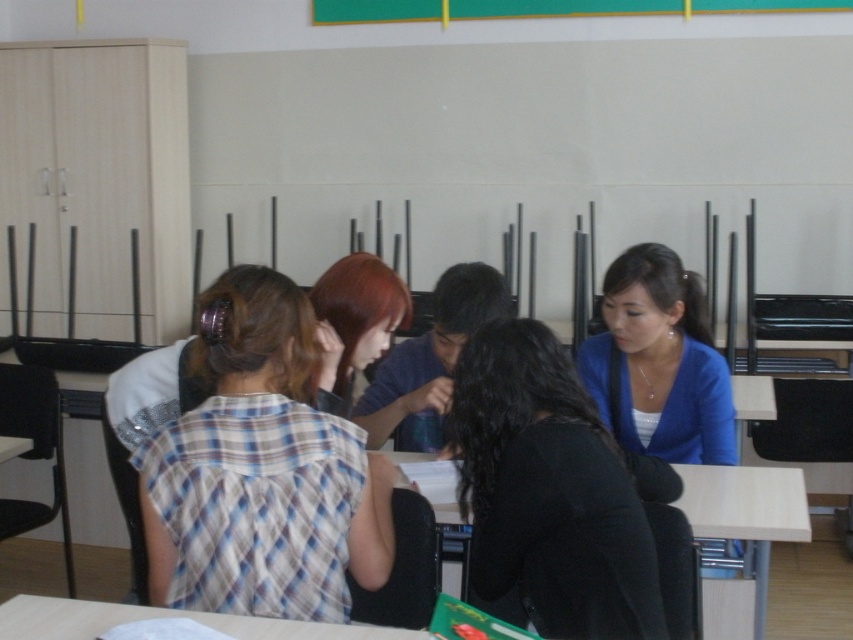
You are a photographer setting up for a group photo in the classroom. You need to ensure that the shiny brown hair at center and the green matte board at upper center are both visible in the frame. Based on their positions, which object should you prioritize keeping centered to avoid one blocking the other?

The shiny brown hair at center is positioned on the left side of green matte board at upper center. To avoid blocking, prioritize keeping the green matte board at upper center centered since it is on the right side of the shiny brown hair at center.

You are a student trying to place your laptop on the table. The laptop requires at least 12 inches of space. Can the blue matte cardigan at center be moved to the light wood table at center without needing to adjust its position?

The distance between the blue matte cardigan at center and the light wood table at center is 12.10 inches, which is just over the required 12 inches. Therefore, the cardigan can be moved to the table without needing to adjust its position.

You are a student trying to reach the pencil sharpener located on the light wood table at center. The plaid fabric shirt at center is blocking your view. Can you move around them to access the table?

The plaid fabric shirt at center is in front of the light wood table at center, so you can move around them to access the table since they are blocking the view but not the entire path.